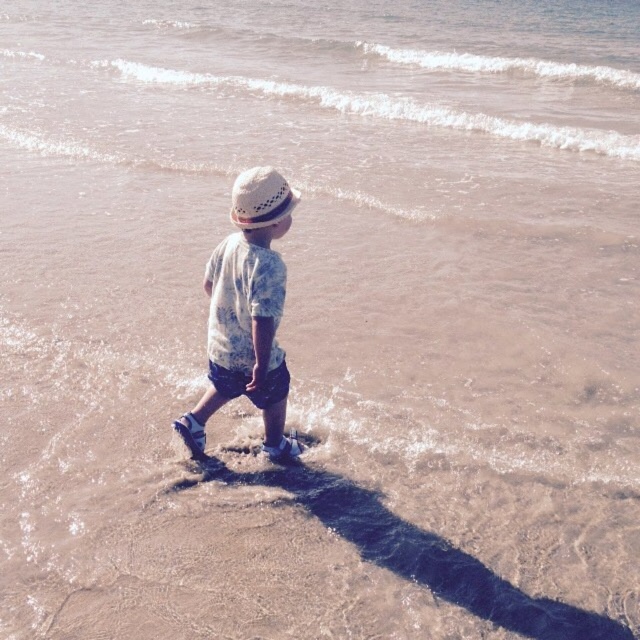
Between light blue cotton shirt at center and white woven hat at center, which one is positioned higher?

white woven hat at center is higher up.

Between point (291, 212) and point (276, 177), which one is positioned in front?

Point (276, 177)

Which is in front, point (250, 284) or point (285, 195)?

Point (250, 284) is in front.

I want to click on light blue cotton shirt at center, so click(248, 314).